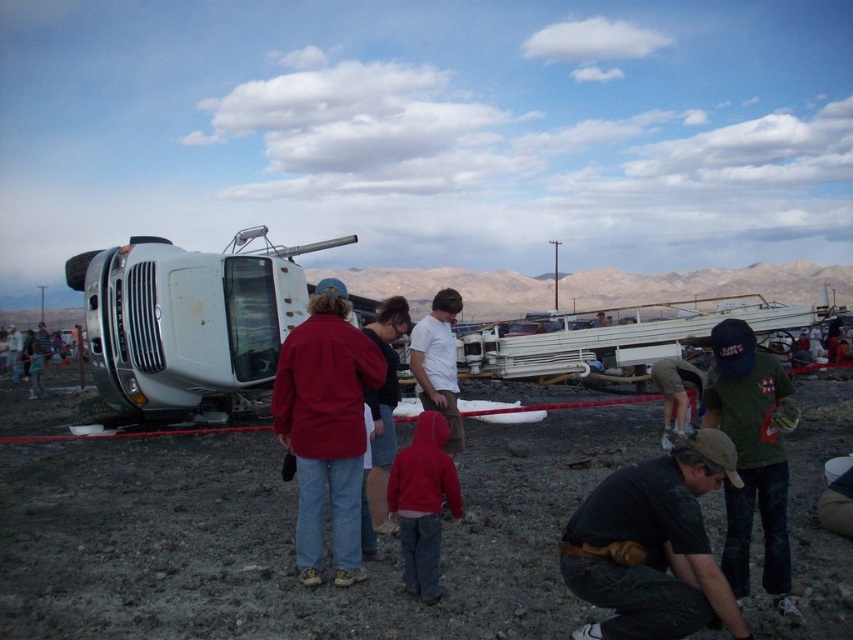
Looking at this image, you are a first responder arriving at the scene of an overturned truck. You notice the dull brown dirt at center and the red jacket at center. Which object is closer to the overturned truck?

The red jacket at center is closer to the overturned truck because the dull brown dirt at center is thinner than the red jacket at center, indicating the jacket is positioned in front of the dirt.

You are a rescue worker at the scene of an overturned truck. You need to locate the green cotton shirt at center. According to the coordinates provided, where exactly should you look?

The green cotton shirt at center is located at coordinates point (751, 458).

You are a photographer at the scene of an overturned truck. You need to capture a photo that includes both the dull brown dirt at center and the red jacket at center. Which object should you focus on first to ensure both are in frame?

The dull brown dirt at center is not as tall as the red jacket at center, so you should focus on the red jacket at center first to ensure both are in frame.